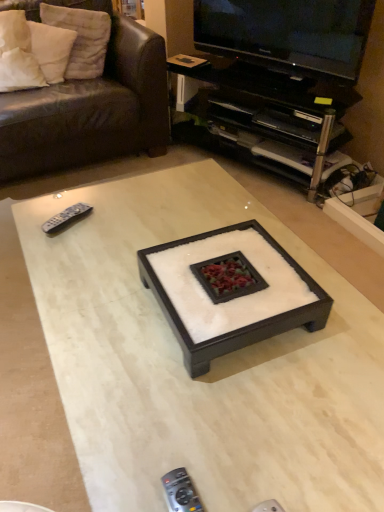
Locate an element on the screen. unoccupied space behind white felt square tray at center, positioned as the first coffee table in top-to-bottom order is located at coordinates (190, 218).